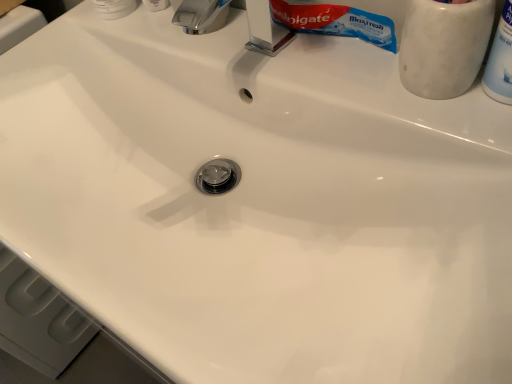
Identify the location of vacant area that is in front of white plastic toothpaste tube at upper left, which ranks as the first toiletry in left-to-right order. (164, 43).